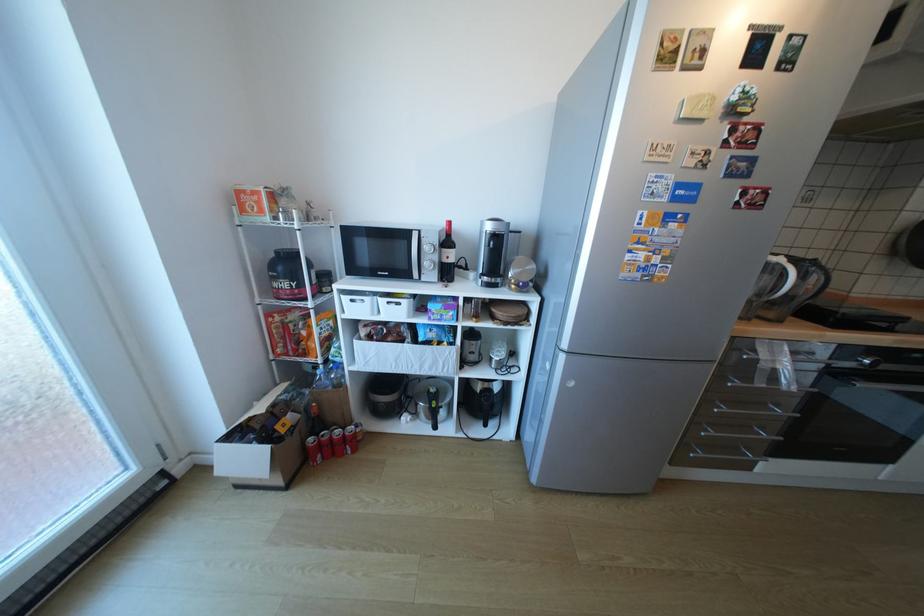
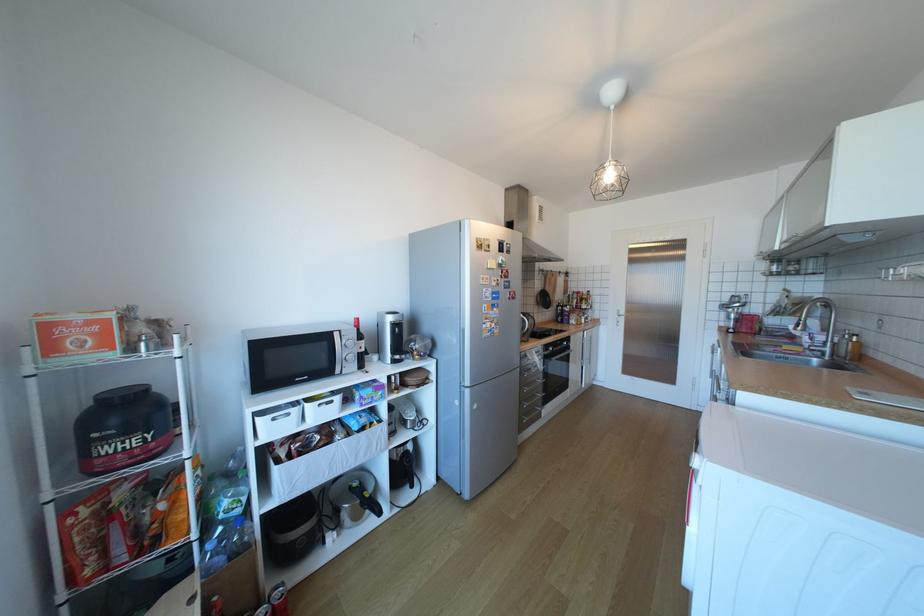
In the second image, find the point that corresponds to pixel 787 442 in the first image.

(553, 395)